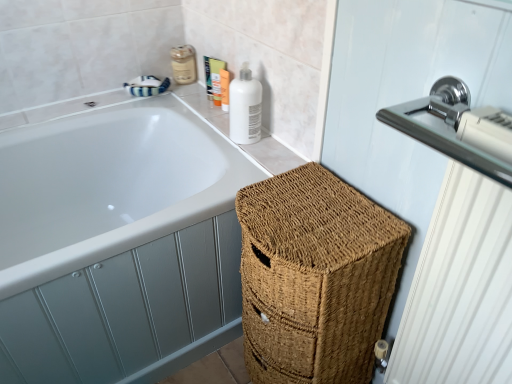
At what (x,y) coordinates should I click in order to perform the action: click on vacant space in between matte beige lotion at upper center, the fourth toiletry positioned from the right, and matte orange tube at upper center, the third toiletry positioned from the left. Please return your answer as a coordinate pair (x, y). Image resolution: width=512 pixels, height=384 pixels. Looking at the image, I should click on (197, 85).